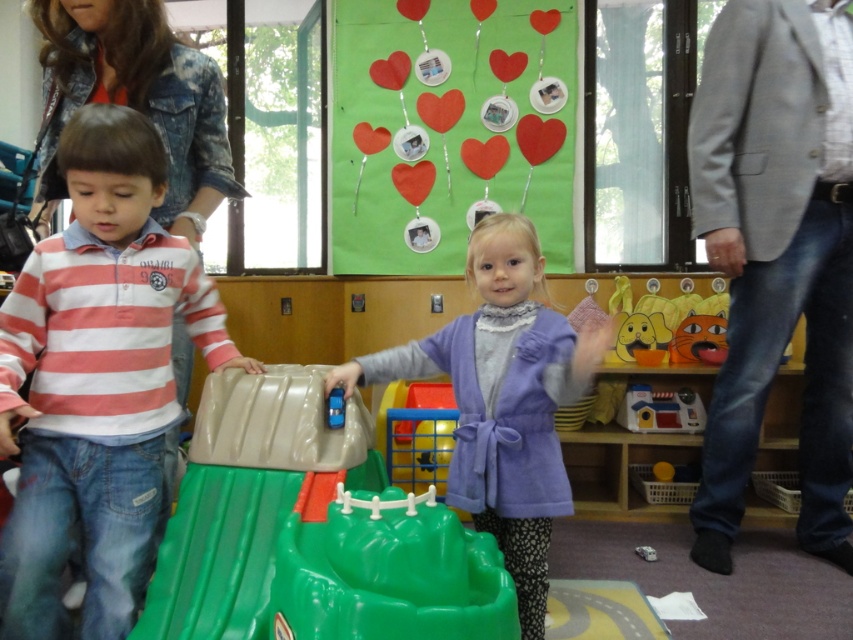
Which is in front, point (386, 365) or point (670, 406)?

Point (386, 365) is more forward.

Can you confirm if purple soft toy at center is positioned to the right of wooden house at right?

In fact, purple soft toy at center is to the left of wooden house at right.

Is point (329, 371) behind point (654, 416)?

That is False.

Where is `purple soft toy at center`? purple soft toy at center is located at coordinates (503, 400).

Does point (457, 176) come in front of point (338, 392)?

No.

Is point (428, 266) positioned behind point (334, 420)?

Yes, point (428, 266) is behind point (334, 420).

Is point (544, 164) positioned before point (341, 394)?

That is False.

Where is `green paper heart at upper center`? green paper heart at upper center is located at coordinates (450, 128).

Is green paper heart at upper center bigger than purple soft toy at center?

Correct, green paper heart at upper center is larger in size than purple soft toy at center.

Who is more forward, (509, 68) or (518, 250)?

Point (518, 250) is in front.

Which is behind, point (550, 209) or point (477, 369)?

Point (550, 209)

Find the location of `green paper heart at upper center`. green paper heart at upper center is located at coordinates (450, 128).